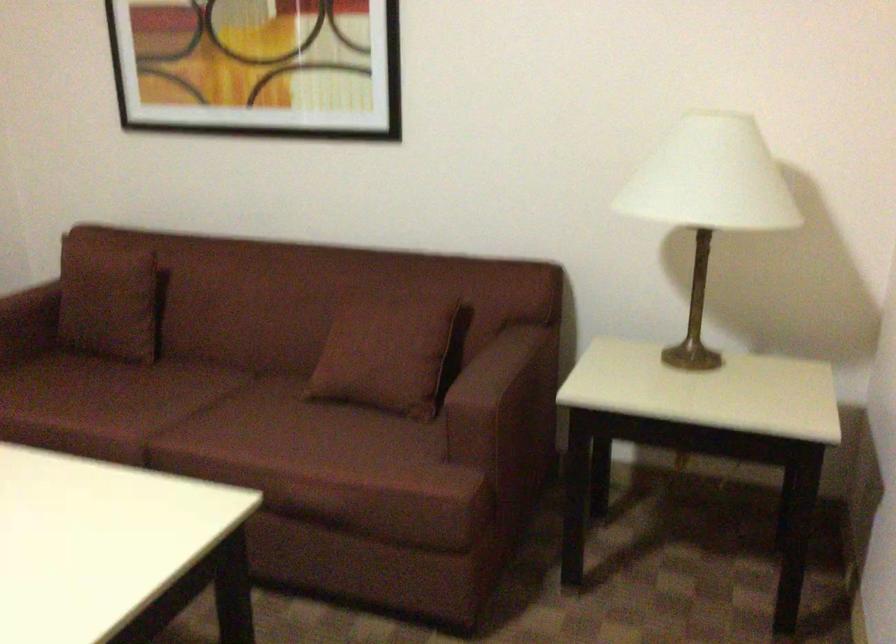
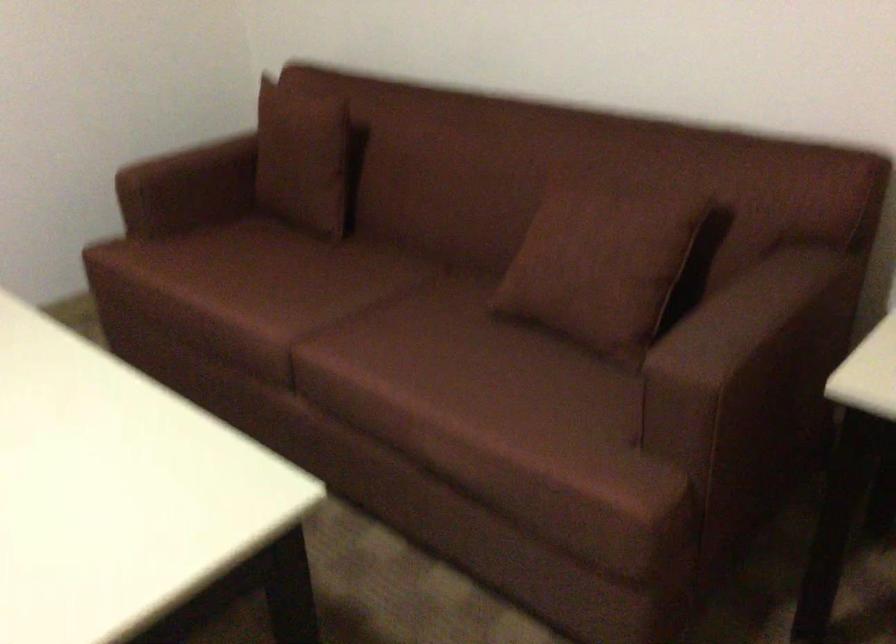
Where in the second image is the point corresponding to (x=537, y=460) from the first image?

(791, 446)